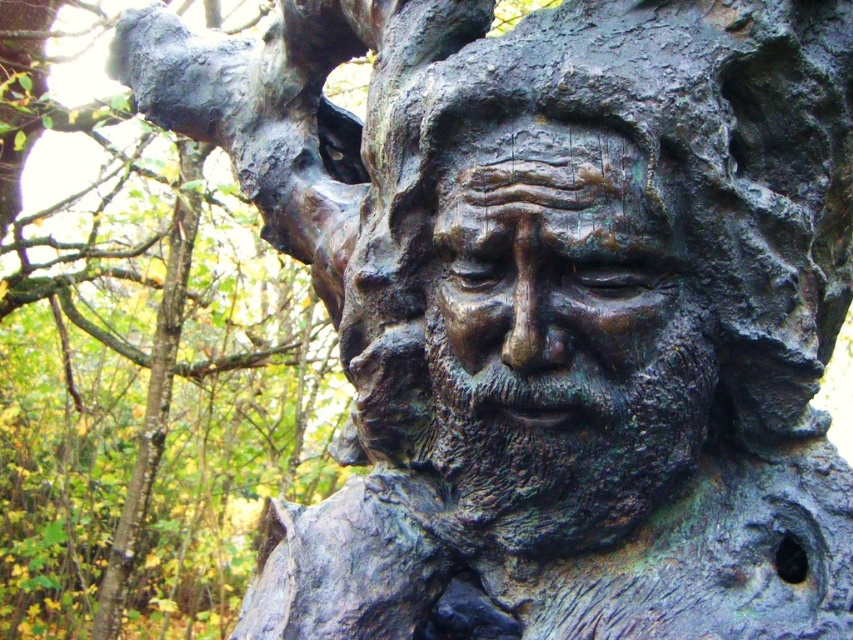
Does bronze textured face at center come behind green patina bark at upper right?

That is False.

Who is more forward, (540, 465) or (170, 243)?

Point (540, 465)

This screenshot has height=640, width=853. I want to click on bronze textured face at center, so click(x=561, y=300).